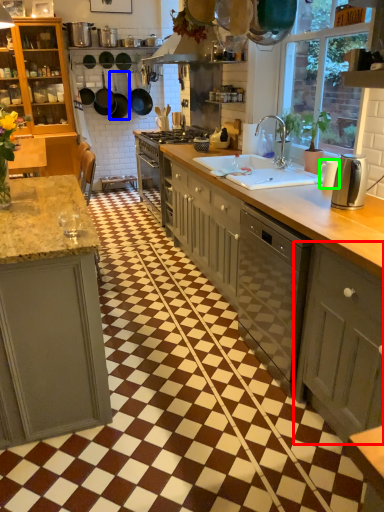
Question: Considering the real-world distances, which object is closest to cabinetry (highlighted by a red box)? frying pan (highlighted by a blue box) or appliance (highlighted by a green box).

Choices:
 (A) frying pan
 (B) appliance

Answer: (B)